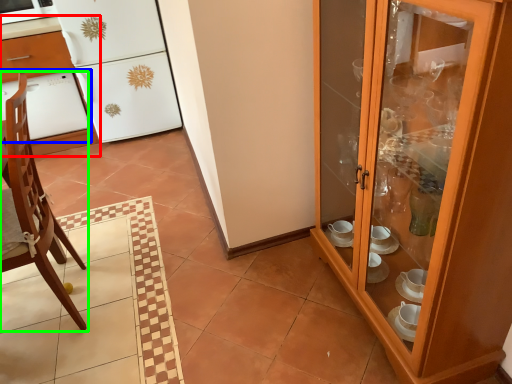
Question: Considering the real-world distances, which object is closest to desk (highlighted by a red box)? oven (highlighted by a blue box) or chair (highlighted by a green box).

Choices:
 (A) oven
 (B) chair

Answer: (A)